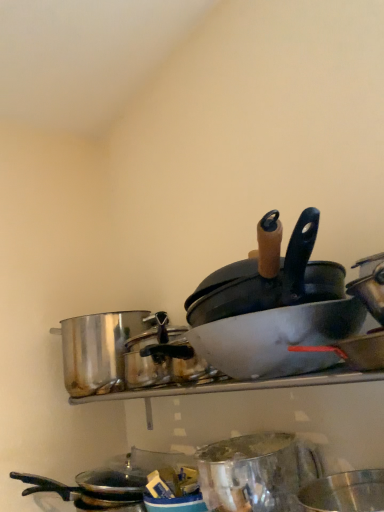
Question: Do you think matte white wok at center is within metallic silver basin at center, which ranks as the 1th basin in top-to-bottom order, or outside of it?

Choices:
 (A) outside
 (B) inside

Answer: (A)

Question: Would you say matte white wok at center is to the left or to the right of metallic silver basin at center, arranged as the second basin when ordered from the bottom, in the picture?

Choices:
 (A) left
 (B) right

Answer: (B)

Question: Which object is the closest to the black matte frying pan at upper right?

Choices:
 (A) matte white wok at center
 (B) metallic silver basin at center, arranged as the second basin when ordered from the bottom
 (C) shiny metallic basin at lower right, the 2th basin when ordered from top to bottom
 (D) metallic silver mixing bowl at center
 (E) shiny metallic pot at left

Answer: (B)

Question: Which of these objects is positioned farthest from the shiny metallic pot at left?

Choices:
 (A) black matte frying pan at upper right
 (B) shiny metallic basin at lower right, which appears as the 1th basin when ordered from the bottom
 (C) matte white wok at center
 (D) metallic silver basin at center, arranged as the second basin when ordered from the bottom
 (E) metallic silver mixing bowl at center

Answer: (C)